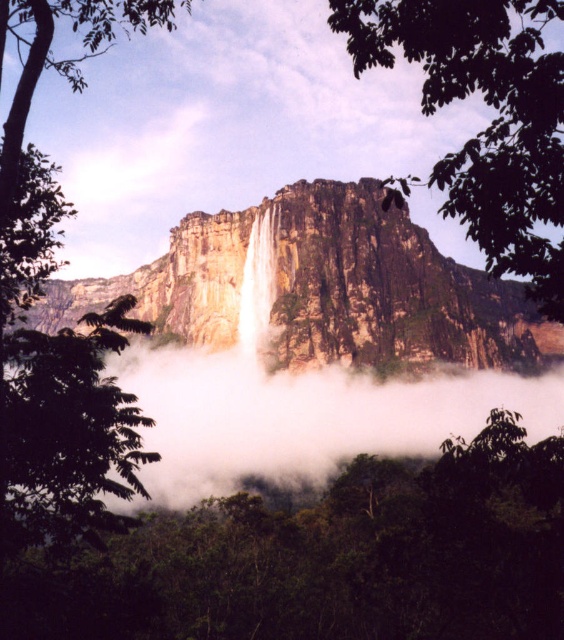
Who is lower down, rocky cliff at center or green leafy tree at center?

rocky cliff at center is lower down.

This screenshot has width=564, height=640. I want to click on rocky cliff at center, so click(x=324, y=289).

Does rocky cliff at center have a lesser height compared to white smooth waterfall at center?

No.

This screenshot has height=640, width=564. In order to click on rocky cliff at center in this screenshot , I will do `click(324, 289)`.

Looking at this image, is green leafy tree at center further to camera compared to white smooth waterfall at center?

No, green leafy tree at center is in front of white smooth waterfall at center.

Locate an element on the screen. green leafy tree at center is located at coordinates (491, 122).

Where is `green leafy tree at center`? This screenshot has width=564, height=640. green leafy tree at center is located at coordinates (491, 122).